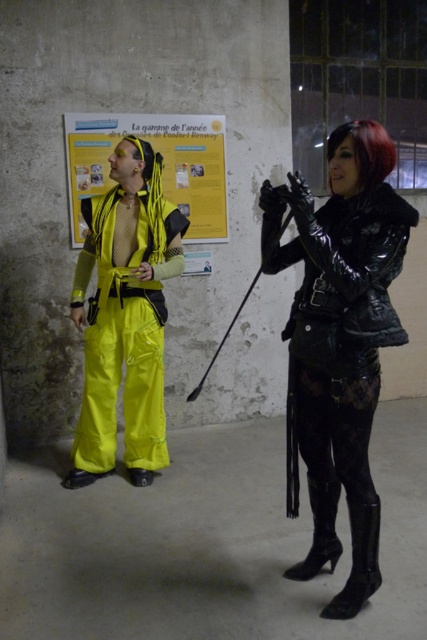
Does black patent leather boot at lower center appear under short red hair at upper right?

Yes.

Between black patent leather boot at lower center and short red hair at upper right, which one has less height?

short red hair at upper right is shorter.

This screenshot has height=640, width=427. What do you see at coordinates (319, 531) in the screenshot?
I see `black patent leather boot at lower center` at bounding box center [319, 531].

Identify the location of black patent leather boot at lower center. The image size is (427, 640). (319, 531).

Does point (111, 317) come in front of point (181, 150)?

Yes, point (111, 317) is in front of point (181, 150).

Who is higher up, neon yellow fabric pants at left or yellow paper poster at upper center?

Positioned higher is yellow paper poster at upper center.

Between point (143, 148) and point (192, 200), which one is positioned in front?

Point (143, 148) is in front.

Identify the location of neon yellow fabric pants at left. (125, 316).

Can you confirm if glossy black leather jacket at right is positioned below neon yellow fabric pants at left?

Indeed, glossy black leather jacket at right is positioned under neon yellow fabric pants at left.

Does glossy black leather jacket at right have a greater width compared to neon yellow fabric pants at left?

No, glossy black leather jacket at right is not wider than neon yellow fabric pants at left.

Where is `glossy black leather jacket at right`? The height and width of the screenshot is (640, 427). glossy black leather jacket at right is located at coordinates (342, 337).